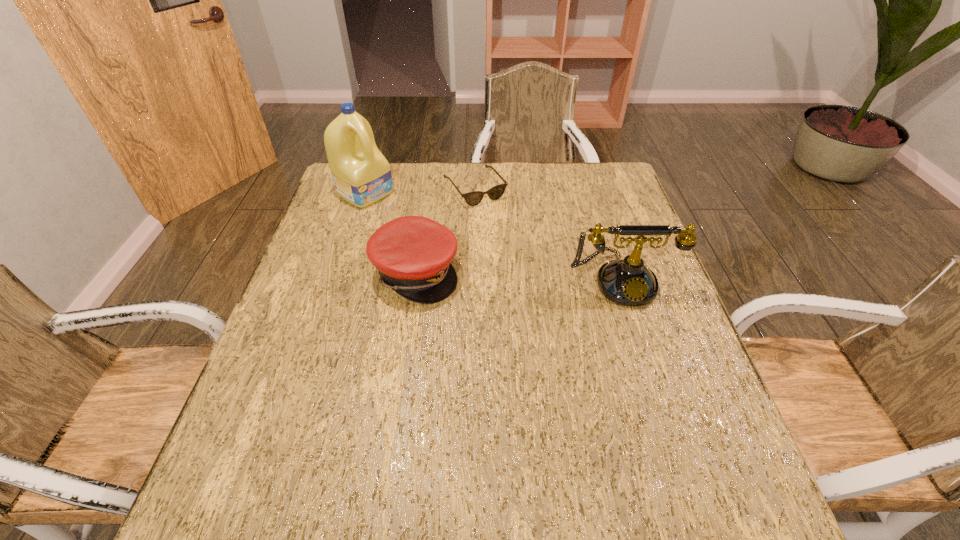
Select which object is the closest to the cap. Please provide its 2D coordinates. Your answer should be formatted as a tuple, i.e. [(x, y)], where the tuple contains the x and y coordinates of a point satisfying the conditions above.

[(362, 176)]

Locate an element on the screen. The height and width of the screenshot is (540, 960). vacant space that satisfies the following two spatial constraints: 1. on the back side of the shortest object; 2. on the right side of the tallest object is located at coordinates (366, 190).

This screenshot has width=960, height=540. Find the location of `vacant point that satisfies the following two spatial constraints: 1. on the back side of the shortest object; 2. on the left side of the detergent`. vacant point that satisfies the following two spatial constraints: 1. on the back side of the shortest object; 2. on the left side of the detergent is located at coordinates (366, 190).